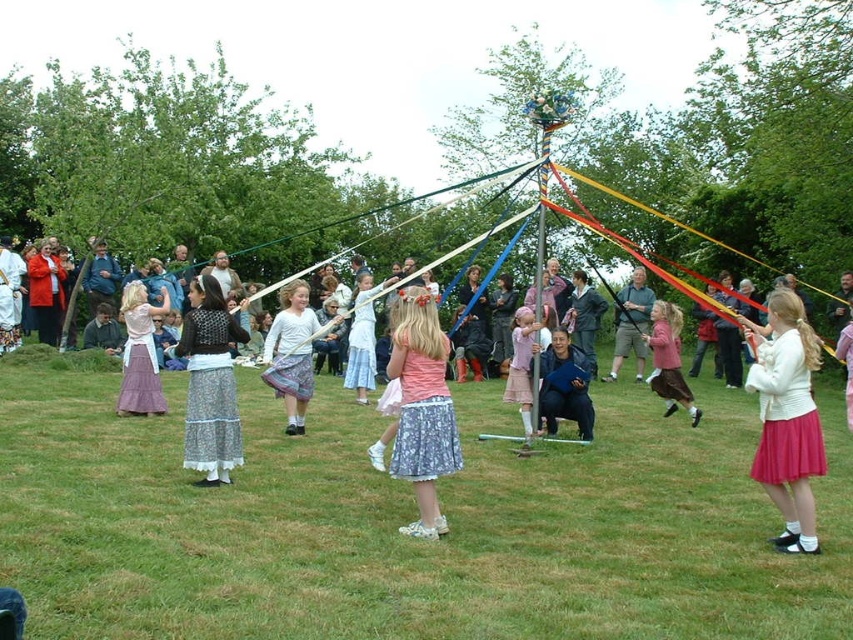
Is matte pink skirt at center to the right of matte gray sweater at center from the viewer's perspective?

Incorrect, matte pink skirt at center is not on the right side of matte gray sweater at center.

Can you confirm if matte pink skirt at center is wider than matte gray sweater at center?

In fact, matte pink skirt at center might be narrower than matte gray sweater at center.

What are the coordinates of `matte pink skirt at center` in the screenshot? It's located at (669, 360).

The width and height of the screenshot is (853, 640). Find the location of `matte pink skirt at center`. matte pink skirt at center is located at coordinates (669, 360).

Between matte pink skirt at right and purple satin dress at center, which one has more height?

Standing taller between the two is matte pink skirt at right.

Consider the image. Between matte pink skirt at right and purple satin dress at center, which one has less height?

Standing shorter between the two is purple satin dress at center.

Identify the location of matte pink skirt at right. (787, 417).

Is the position of green grass at center more distant than that of matte pink skirt at right?

No, it is not.

Between point (177, 572) and point (817, 547), which one is positioned in front?

Point (177, 572) is in front.

Who is more forward, [276,512] or [793,301]?

Point [793,301] is more forward.

Identify the location of green grass at center. The width and height of the screenshot is (853, 640). (403, 524).